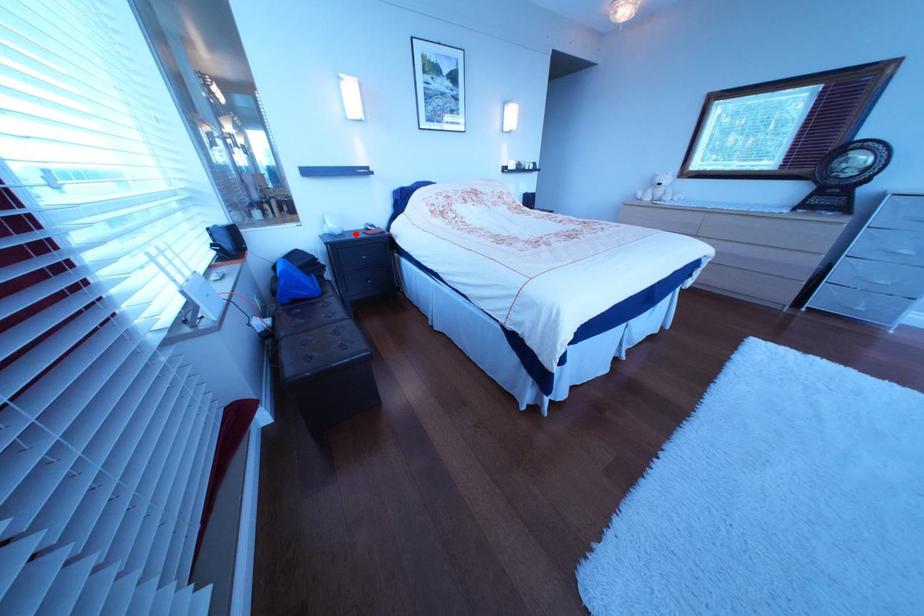
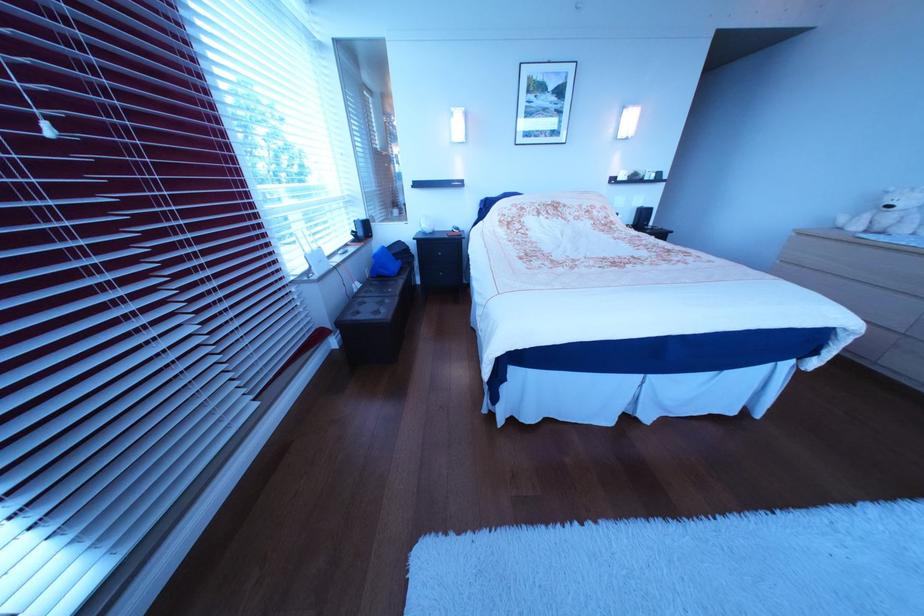
The point at the highlighted location is marked in the first image. Where is the corresponding point in the second image?

(445, 233)